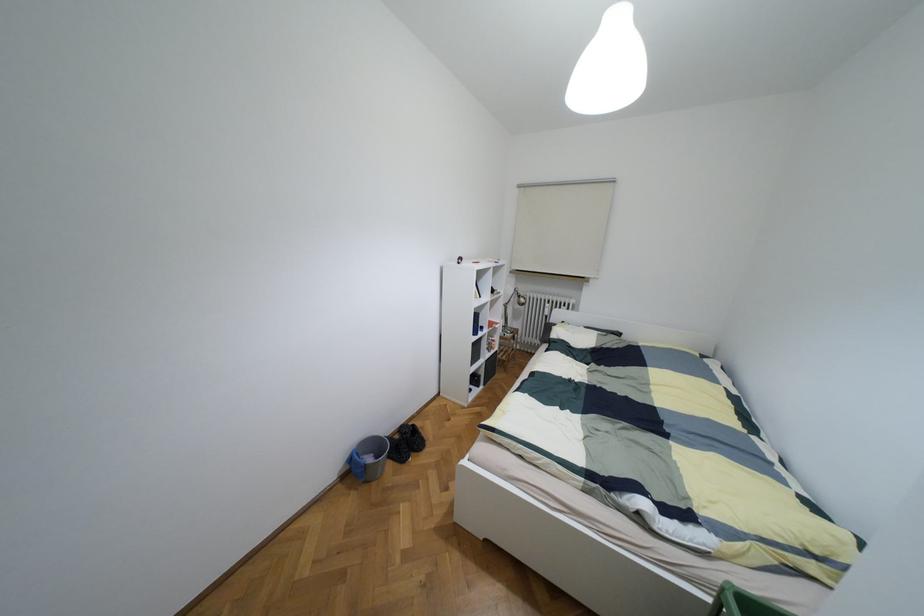
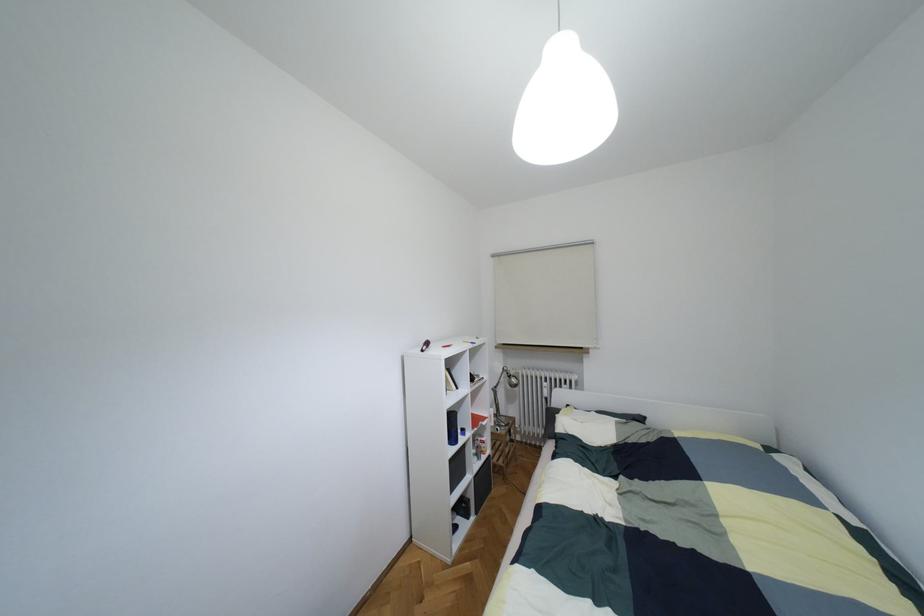
The point at (499, 359) is marked in the first image. Where is the corresponding point in the second image?

(493, 464)